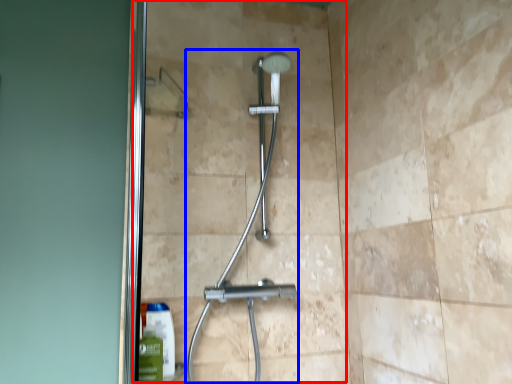
Question: Among these objects, which one is nearest to the camera, glass door (highlighted by a red box) or shower (highlighted by a blue box)?

Choices:
 (A) glass door
 (B) shower

Answer: (B)